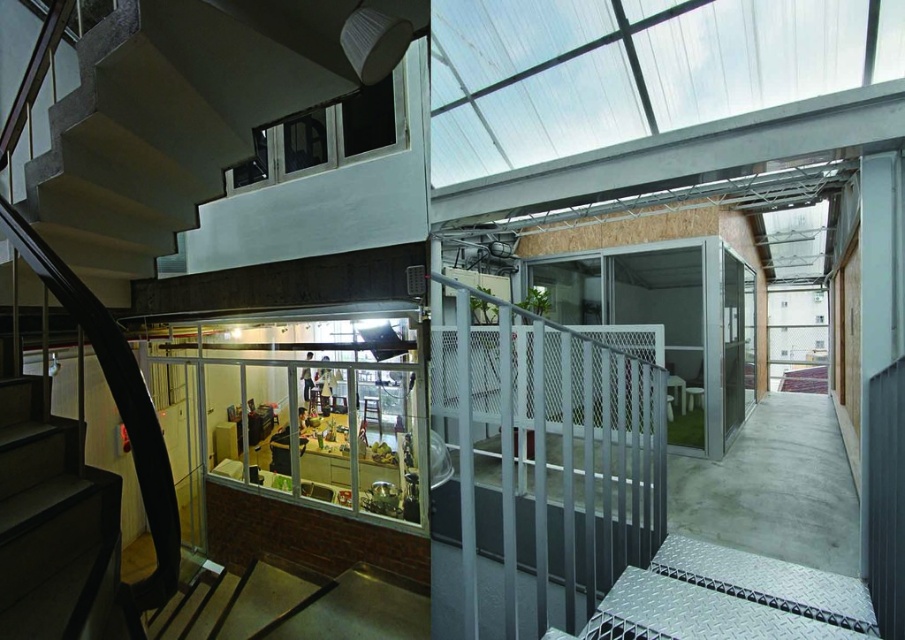
Question: Which object appears closest to the camera in this image?

Choices:
 (A) concrete stairs at lower left
 (B) metallic mesh railing at center

Answer: (B)

Question: Which object is farther from the camera taking this photo?

Choices:
 (A) concrete stairs at lower left
 (B) metallic mesh railing at center

Answer: (A)

Question: From the image, what is the correct spatial relationship of metallic mesh railing at center in relation to concrete stairs at lower left?

Choices:
 (A) below
 (B) above

Answer: (A)

Question: Can you confirm if metallic mesh railing at center is positioned above concrete stairs at lower left?

Choices:
 (A) no
 (B) yes

Answer: (A)

Question: Can you confirm if metallic mesh railing at center is positioned below concrete stairs at lower left?

Choices:
 (A) yes
 (B) no

Answer: (A)